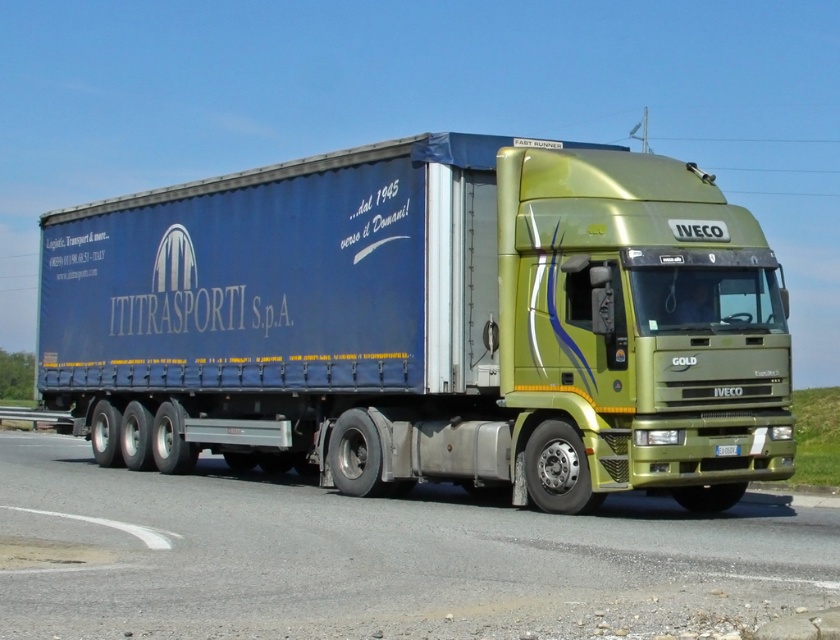
Question: Among these points, which one is farthest from the camera?

Choices:
 (A) (510, 593)
 (B) (155, 212)

Answer: (B)

Question: Which point is farther to the camera?

Choices:
 (A) (555, 432)
 (B) (90, 580)

Answer: (A)

Question: Is metallic gold truck at center wider than green metallic highway at center?

Choices:
 (A) yes
 (B) no

Answer: (B)

Question: Is metallic gold truck at center bigger than green metallic highway at center?

Choices:
 (A) no
 (B) yes

Answer: (B)

Question: Does metallic gold truck at center have a lesser width compared to green metallic highway at center?

Choices:
 (A) yes
 (B) no

Answer: (A)